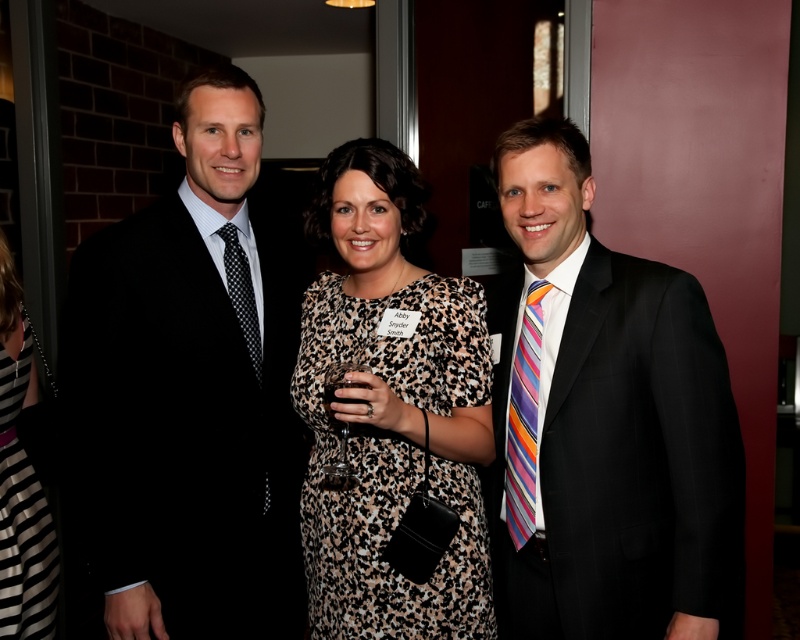
You are a photographer at the event and want to ensure that the black pinstripe suit at right and the leopard print dress at center are both visible in the photo. Based on their heights, which one might need to be positioned closer to the front to ensure both are visible?

The leopard print dress at center should be positioned closer to the front since the black pinstripe suit at right is taller and could obscure the dress if placed behind it.

Based on the photo, you are standing 5 feet away from the point at coordinates (534, 246). Can you reach it without moving closer?

The point at coordinates (534, 246) is 4.96 feet away from the viewer, so yes, you can reach it without moving closer since you are already within the 5 feet distance.